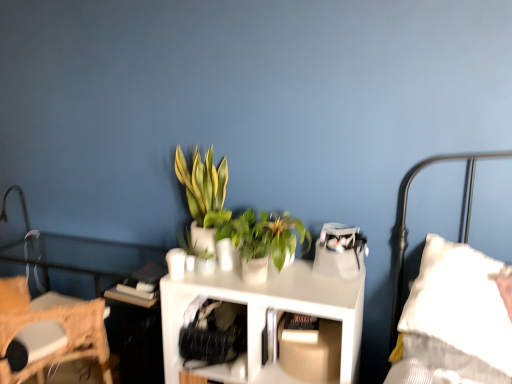
The width and height of the screenshot is (512, 384). Identify the location of vacant space in front of green matte plant at center, which is counted as the 1th houseplant, starting from the right. (298, 289).